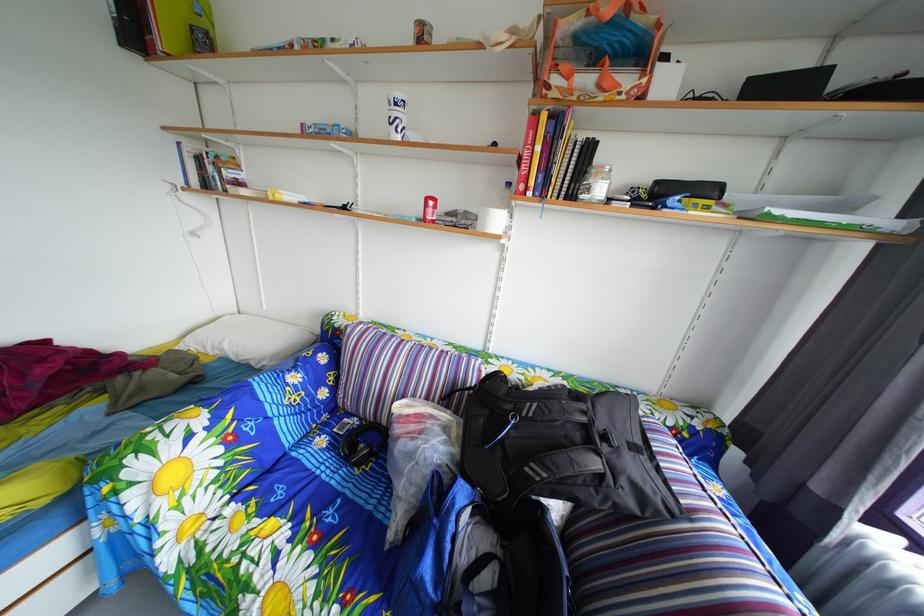
Image resolution: width=924 pixels, height=616 pixels. Describe the element at coordinates (617, 9) in the screenshot. I see `the orange bag handle` at that location.